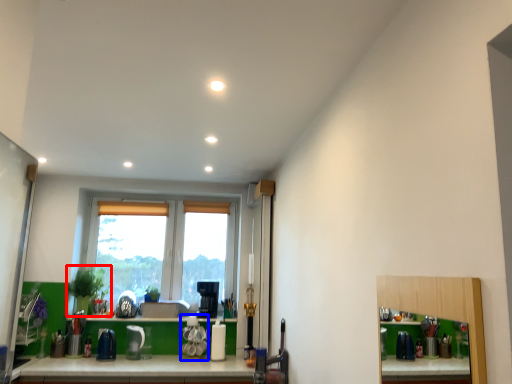
Question: Among these objects, which one is nearest to the camera, plant (highlighted by a red box) or appliance (highlighted by a blue box)?

Choices:
 (A) plant
 (B) appliance

Answer: (B)